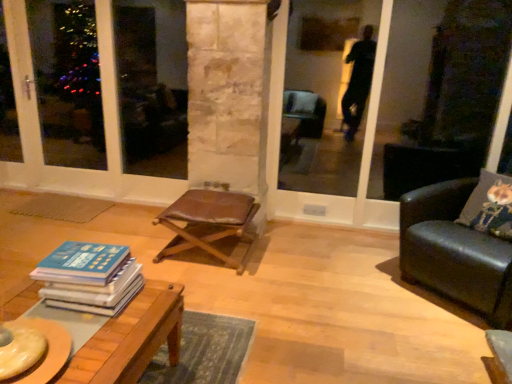
Where is `free region under leather stool at center (from a real-world perspective)`? This screenshot has height=384, width=512. free region under leather stool at center (from a real-world perspective) is located at coordinates (210, 261).